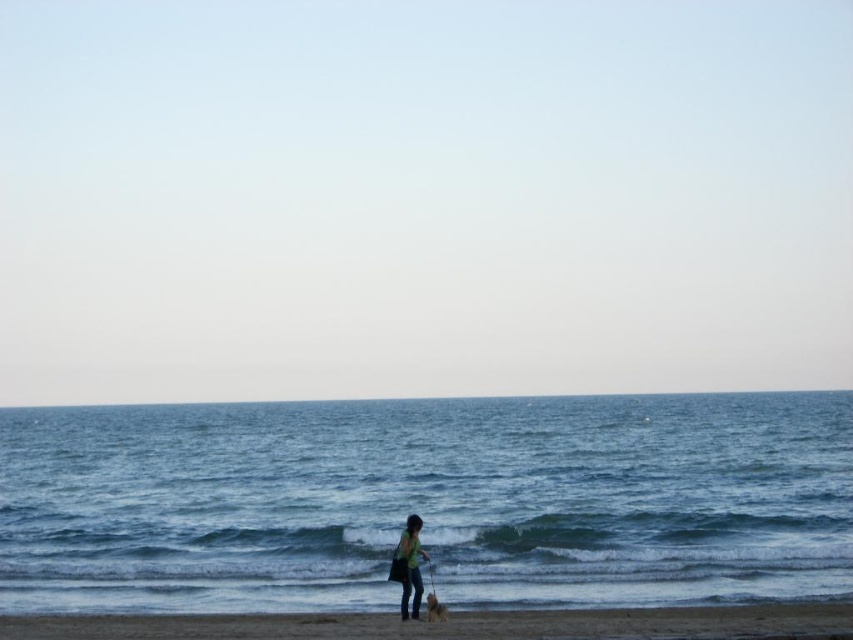
Question: Can you confirm if blue water at lower center is thinner than short-haired brown dog at lower center?

Choices:
 (A) no
 (B) yes

Answer: (A)

Question: Can you confirm if brown sand at lower center is positioned below short-haired brown dog at lower center?

Choices:
 (A) yes
 (B) no

Answer: (A)

Question: Considering the real-world distances, which object is closest to the green fabric shirt at lower center?

Choices:
 (A) blue water at lower center
 (B) short-haired brown dog at lower center
 (C) brown sand at lower center

Answer: (B)

Question: Can you confirm if blue water at lower center is thinner than brown sand at lower center?

Choices:
 (A) yes
 (B) no

Answer: (B)

Question: Which point is closer to the camera?

Choices:
 (A) 97,461
 (B) 434,602

Answer: (B)

Question: Among these objects, which one is farthest from the camera?

Choices:
 (A) short-haired brown dog at lower center
 (B) brown sand at lower center
 (C) green fabric shirt at lower center

Answer: (C)